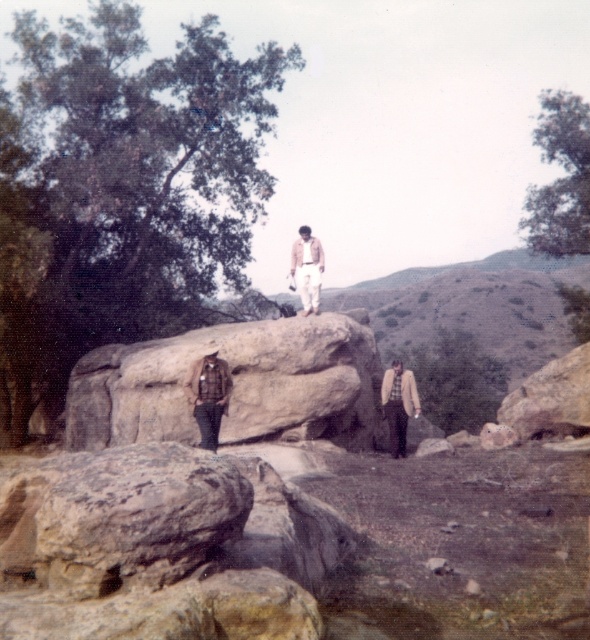
You are hiking and see the rusty stone boulder at lower left and the light brown woolen jacket at center. Which object is positioned to the left?

The rusty stone boulder at lower left is positioned to the left of the light brown woolen jacket at center.

You are standing at the center of the image. Which direction should you walk to reach the brown plaid shirt at lower left?

You should walk towards the lower left direction to reach the brown plaid shirt at lower left.

You are standing at the center of the image and want to locate the rusty stone boulder at lower left. Which direction should you face to see it?

You should face the lower left direction to see the rusty stone boulder at lower left, as it is located at point coordinates of (162, 547).